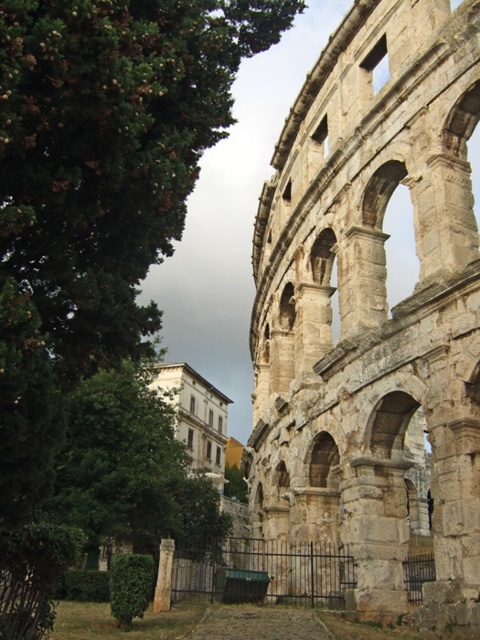
You are standing on the paved pathway in front of the ancient stone structure. You notice the stone arches at right and the smooth stone pillar at center. Which of these two objects is nearer to you?

The stone arches at right are closer to the viewer than the smooth stone pillar at center, so the stone arches at right is nearer to you.

You are a tour guide explaining the ancient stone structure to visitors. You mention the stone arches at right and the green leafy tree at center. Which one is taller?

The stone arches at right are much taller than the green leafy tree at center.

You are standing at the entrance of the ancient stone structure and want to take a photo of the green leafy tree at center. Where should you position yourself to capture the tree in the frame?

The green leafy tree at center is located at coordinates point (x=132, y=467), so you should position yourself to the left side of the structure to capture it in the frame.